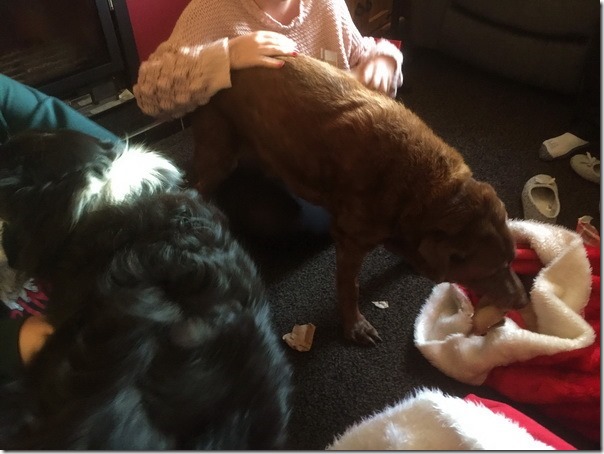
You are a GUI agent. You are given a task and a screenshot of the screen. Output one action in this format:
    pyautogui.click(x=<x>, y=<y>)
    Task: Click on the christmas stocking on floor
    This screenshot has width=604, height=454.
    Given the screenshot: What is the action you would take?
    click(x=541, y=364)